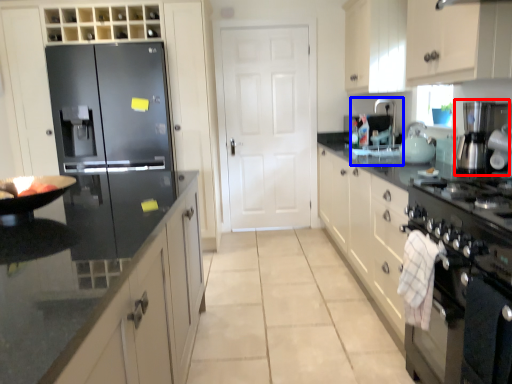
Question: Which of the following is the closest to the observer, appliance (highlighted by a red box) or sink (highlighted by a blue box)?

Choices:
 (A) appliance
 (B) sink

Answer: (A)